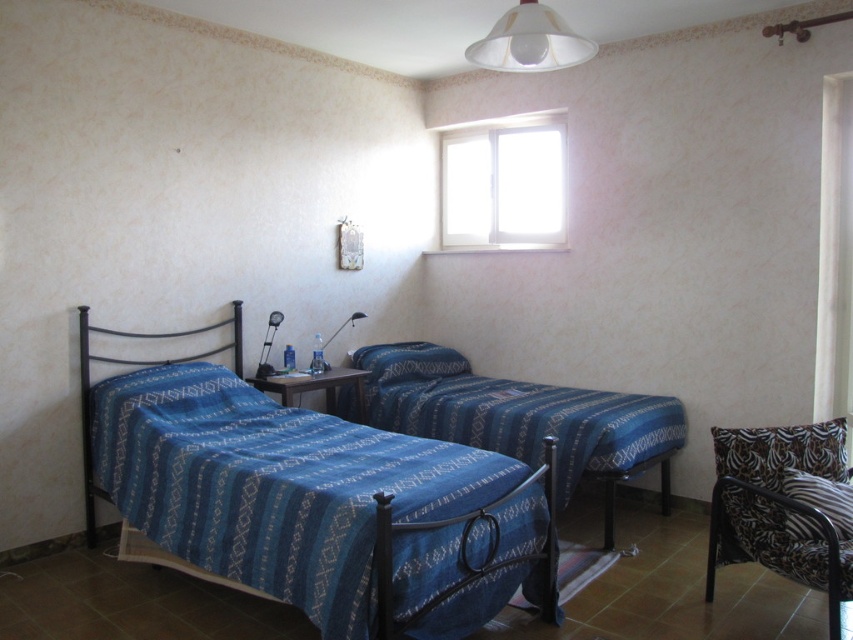
Question: Is blue woven fabric bed at center closer to the viewer compared to white matte lampshade at upper center?

Choices:
 (A) no
 (B) yes

Answer: (A)

Question: Which point appears closest to the camera in this image?

Choices:
 (A) (741, 486)
 (B) (328, 458)
 (C) (460, 164)

Answer: (A)

Question: Does blue fabric bed at left have a larger size compared to blue woven fabric bed at center?

Choices:
 (A) no
 (B) yes

Answer: (B)

Question: Is zebra-patterned fabric chair at lower right further to camera compared to white matte lampshade at upper center?

Choices:
 (A) no
 (B) yes

Answer: (B)

Question: Which is nearer to the zebra-patterned fabric chair at lower right?

Choices:
 (A) white matte lampshade at upper center
 (B) white glass window at upper center
 (C) blue fabric bed at left

Answer: (C)

Question: Which of the following is the closest to the observer?

Choices:
 (A) (718, 554)
 (B) (508, 58)
 (C) (395, 618)
 (D) (450, 356)

Answer: (C)